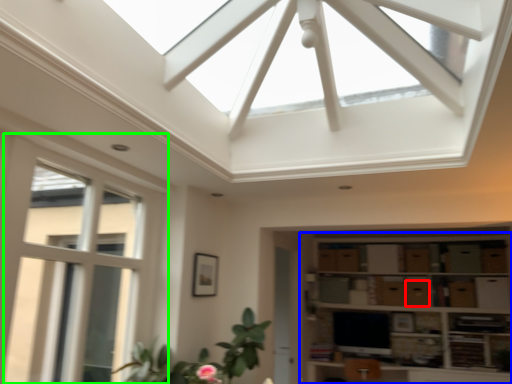
Question: Which object is the farthest from drawer (highlighted by a red box)? Choose among these: shelf (highlighted by a blue box) or window (highlighted by a green box).

Choices:
 (A) shelf
 (B) window

Answer: (B)